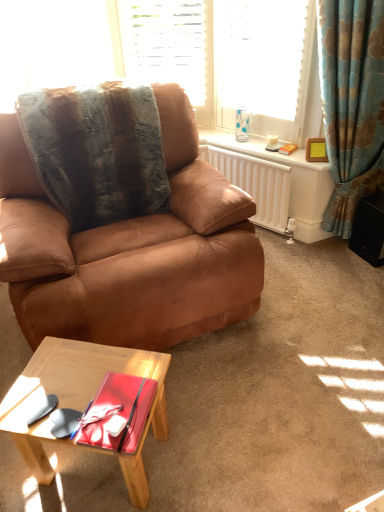
Identify the location of unoccupied region to the right of light wood coffee table at lower left. The image size is (384, 512). (216, 440).